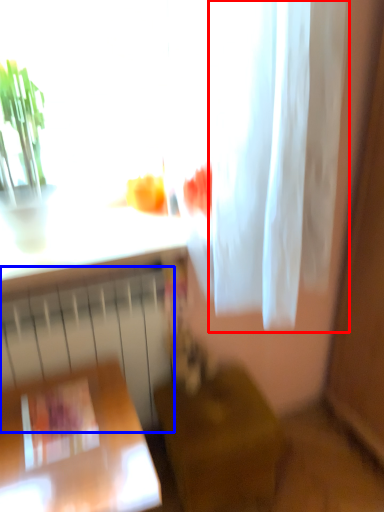
Question: Among these objects, which one is farthest to the camera, shower curtain (highlighted by a red box) or radiator (highlighted by a blue box)?

Choices:
 (A) shower curtain
 (B) radiator

Answer: (B)